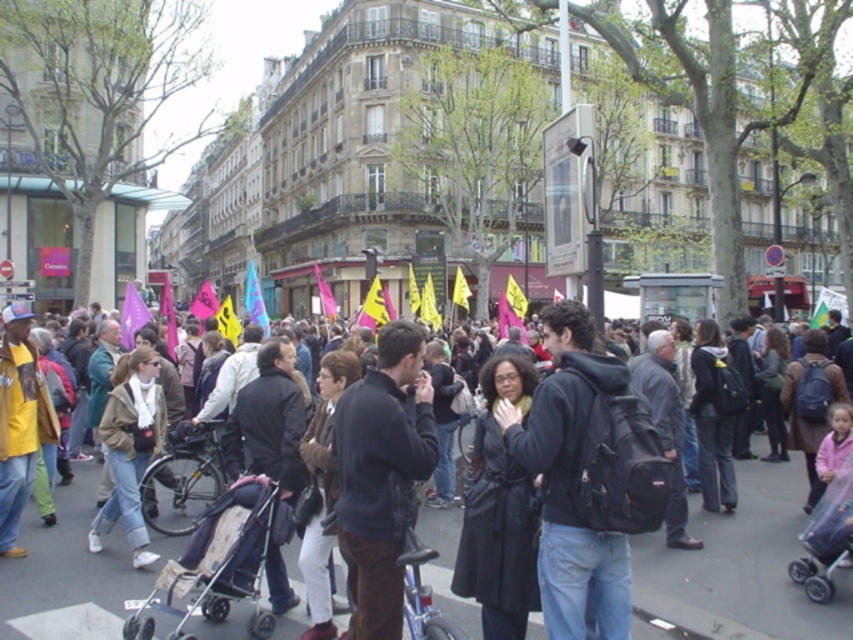
Question: Estimate the real-world distances between objects in this image. Which object is farther from the dark blue jacket at center?

Choices:
 (A) transparent plastic baby carriage at lower right
 (B) dark gray asphalt at center
 (C) light brown leather jacket at center

Answer: (A)

Question: Which point is closer to the camera?

Choices:
 (A) (436, 532)
 (B) (570, 630)

Answer: (B)

Question: Does black backpack at center appear on the left side of light brown leather jacket at center?

Choices:
 (A) yes
 (B) no

Answer: (B)

Question: Which object is closer to the camera taking this photo?

Choices:
 (A) dark blue jacket at center
 (B) transparent plastic baby carriage at lower right
 (C) black backpack at center

Answer: (A)

Question: Is beige fabric stroller at lower left smaller than light brown leather jacket at center?

Choices:
 (A) no
 (B) yes

Answer: (B)

Question: Does dark gray asphalt at center appear on the right side of dark blue jacket at center?

Choices:
 (A) no
 (B) yes

Answer: (B)